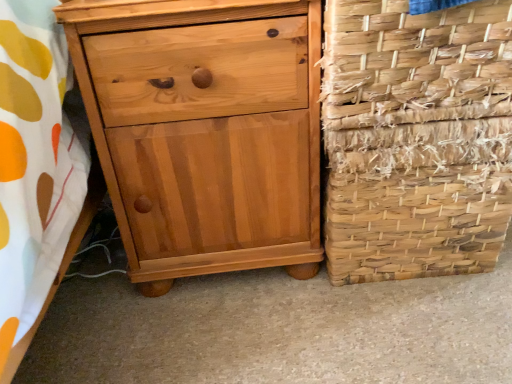
Question: Is woven straw basket at right to the left or to the right of light brown wood chest of drawers at left in the image?

Choices:
 (A) right
 (B) left

Answer: (A)

Question: From a real-world perspective, relative to light brown wood chest of drawers at left, is woven straw basket at right vertically above or below?

Choices:
 (A) below
 (B) above

Answer: (B)

Question: Which is farther from the woven natural fiber basket at right?

Choices:
 (A) light brown wood chest of drawers at left
 (B) woven straw basket at right

Answer: (A)

Question: Considering the real-world distances, which object is farthest from the woven straw basket at right?

Choices:
 (A) woven natural fiber basket at right
 (B) light brown wood chest of drawers at left

Answer: (B)